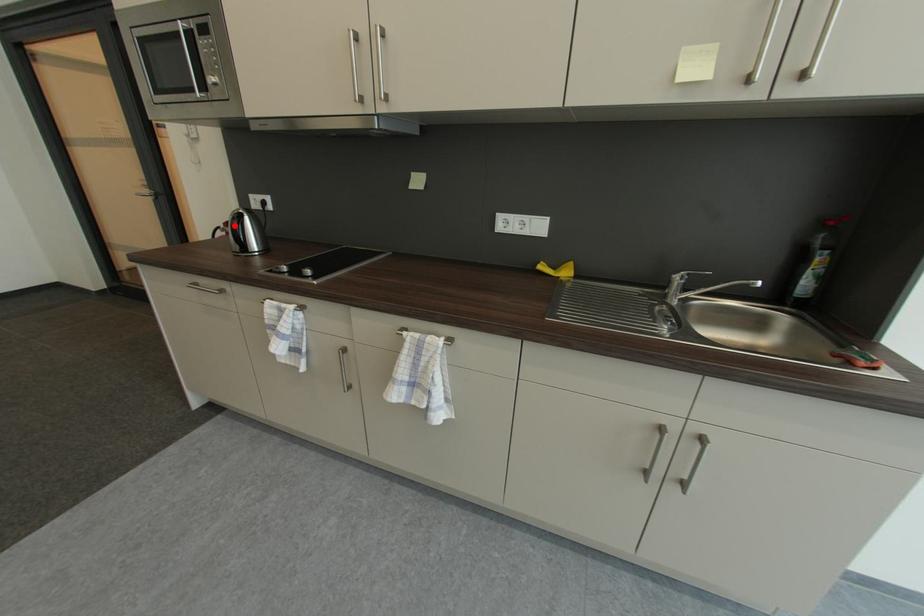
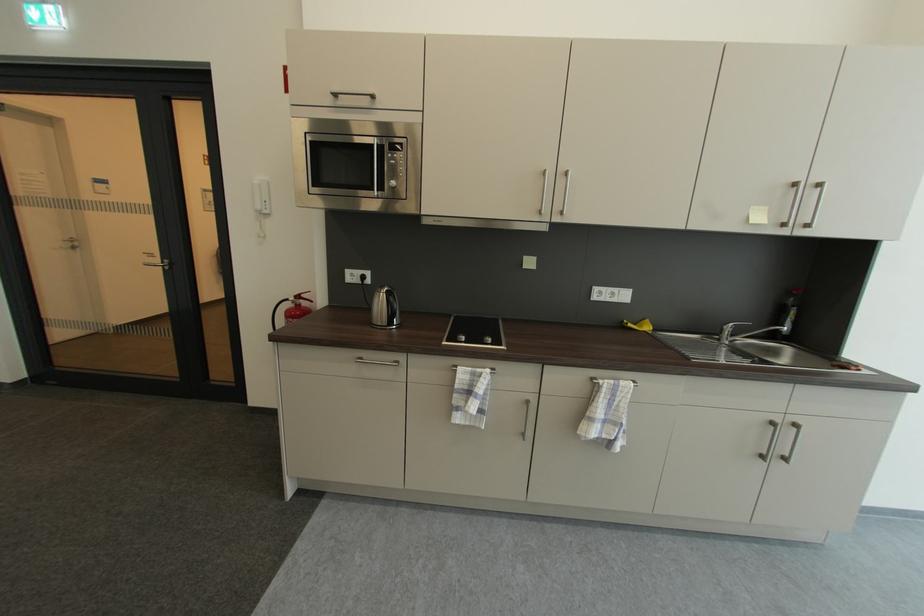
In the second image, find the point that corresponds to the highlighted location in the first image.

(305, 299)